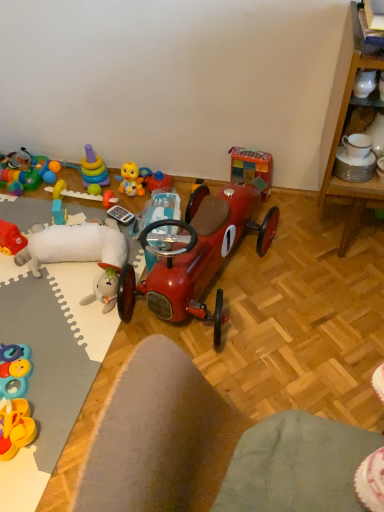
Question: Is translucent plastic block at upper left, the 3th toy positioned from the left, beside shiny red car at center, which is the 10th toy in left-to-right order?

Choices:
 (A) no
 (B) yes

Answer: (A)

Question: Does translucent plastic block at upper left, which is the 9th toy in right-to-left order, have a larger size compared to shiny red car at center, the second toy from the right?

Choices:
 (A) no
 (B) yes

Answer: (A)

Question: Is translucent plastic block at upper left, which is the 9th toy in right-to-left order, looking in the opposite direction of shiny red car at center, the second toy from the right?

Choices:
 (A) no
 (B) yes

Answer: (B)

Question: From a real-world perspective, is translucent plastic block at upper left, the 3th toy positioned from the left, on shiny red car at center, the second toy from the right?

Choices:
 (A) no
 (B) yes

Answer: (A)

Question: From a real-world perspective, is translucent plastic block at upper left, which is the 9th toy in right-to-left order, under shiny red car at center, the second toy from the right?

Choices:
 (A) yes
 (B) no

Answer: (A)

Question: Is matte plastic desk at center in front of or behind rubberized multicolored ball at left, acting as the 1th toy starting from the left, in the image?

Choices:
 (A) front
 (B) behind

Answer: (A)

Question: Based on their sizes in the image, would you say matte plastic desk at center is bigger or smaller than rubberized multicolored ball at left, which is counted as the 11th toy, starting from the right?

Choices:
 (A) big
 (B) small

Answer: (A)

Question: From a real-world perspective, relative to rubberized multicolored ball at left, acting as the 1th toy starting from the left, is matte plastic desk at center vertically above or below?

Choices:
 (A) below
 (B) above

Answer: (B)

Question: From the image's perspective, is matte plastic desk at center positioned above or below rubberized multicolored ball at left, which is counted as the 11th toy, starting from the right?

Choices:
 (A) above
 (B) below

Answer: (B)

Question: Relative to rubberized multicolored ball at left, acting as the 1th toy starting from the left, is wooden block tower at upper right, the eleventh toy viewed from the left, in front or behind?

Choices:
 (A) behind
 (B) front

Answer: (B)

Question: Would you say wooden block tower at upper right, the first toy in the right-to-left sequence, is inside or outside rubberized multicolored ball at left, which is counted as the 11th toy, starting from the right?

Choices:
 (A) inside
 (B) outside

Answer: (B)

Question: In terms of size, does wooden block tower at upper right, the eleventh toy viewed from the left, appear bigger or smaller than rubberized multicolored ball at left, which is counted as the 11th toy, starting from the right?

Choices:
 (A) big
 (B) small

Answer: (A)

Question: From the image's perspective, is wooden block tower at upper right, the first toy in the right-to-left sequence, positioned above or below rubberized multicolored ball at left, acting as the 1th toy starting from the left?

Choices:
 (A) above
 (B) below

Answer: (B)

Question: Considering the positions of wooden block tower at upper right, the first toy in the right-to-left sequence, and shiny red car at center, which is the 10th toy in left-to-right order, in the image, is wooden block tower at upper right, the first toy in the right-to-left sequence, wider or thinner than shiny red car at center, which is the 10th toy in left-to-right order,?

Choices:
 (A) wide
 (B) thin

Answer: (B)

Question: Relative to shiny red car at center, the second toy from the right, is wooden block tower at upper right, the eleventh toy viewed from the left, in front or behind?

Choices:
 (A) front
 (B) behind

Answer: (B)